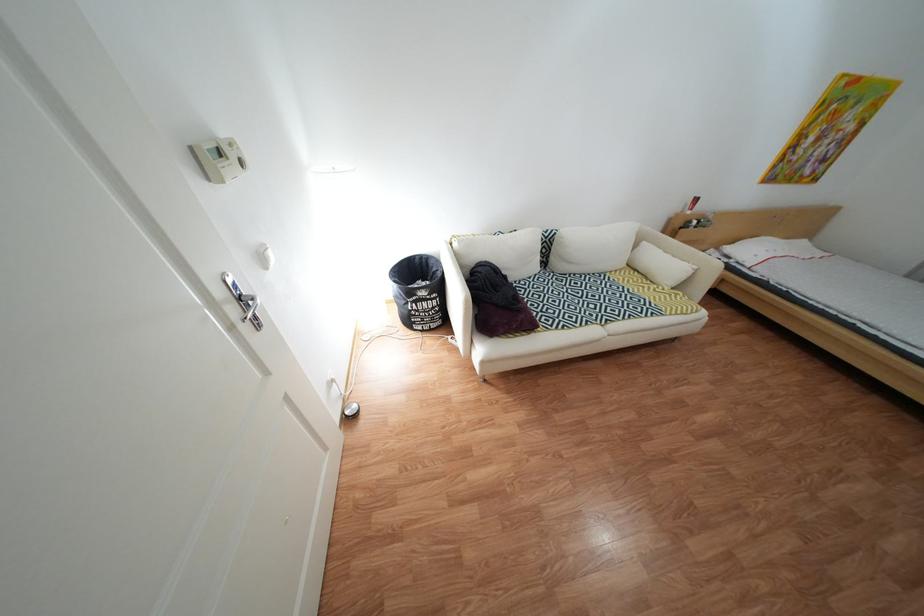
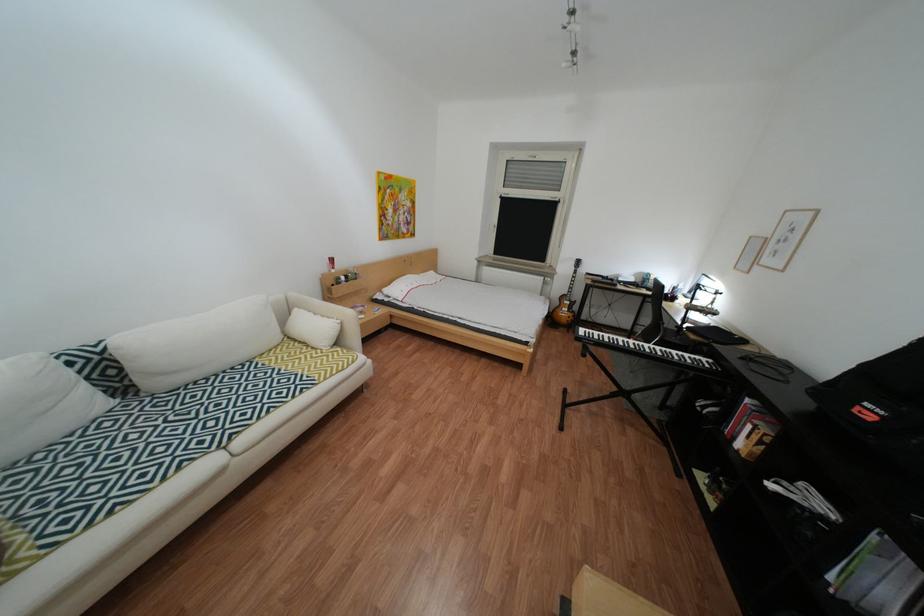
Find the pixel in the second image that matches (x=651, y=272) in the first image.

(311, 342)